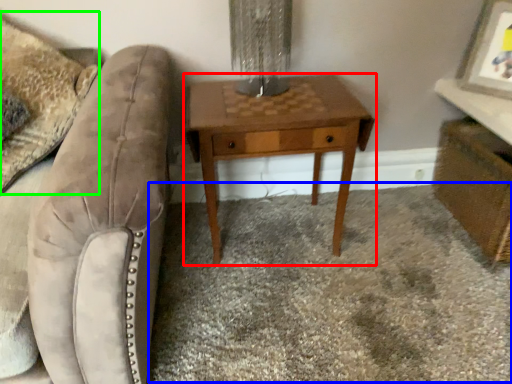
Question: Based on their relative distances, which object is farther from nightstand (highlighted by a red box)? Choose from plain (highlighted by a blue box) and throw pillow (highlighted by a green box).

Choices:
 (A) plain
 (B) throw pillow

Answer: (B)